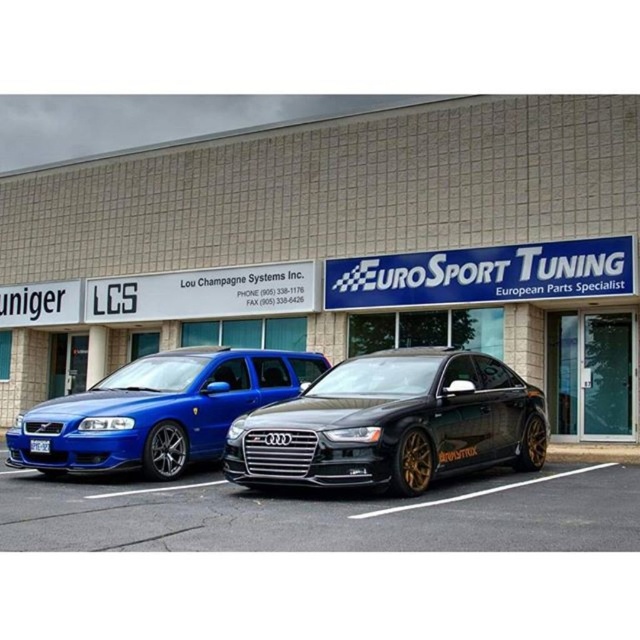
You are driving a car and need to park in a tight space between the metallic blue car at center and the black matte audi sedan at center. The parking space is 1.8 meters wide. Can your car, which is 1.6 meters wide, fit in the space between them?

The space between the metallic blue car at center and the black matte audi sedan at center is 1.8 meters wide. Since your car is 1.6 meters wide, it can fit comfortably within the available space.

You are a delivery driver who needs to park your delivery van in front of the building. The van requires a parking space that is at least 15 feet long. Can you park your van between the metallic blue car at center and the white plastic license plate at center?

The distance between the metallic blue car at center and the white plastic license plate at center is 54.91 feet, which is more than enough to accommodate the delivery van requiring 15 feet of space. Yes, you can park your van there.

Looking at this image, you are a delivery driver who needs to park your truck next to the metallic blue sedan at center and the white plastic license plate at center. Considering the height of the truck, which object should you avoid hitting when parking?

The metallic blue sedan at center is taller than the white plastic license plate at center, so you should avoid hitting the metallic blue sedan at center when parking to prevent damage due to its greater height.